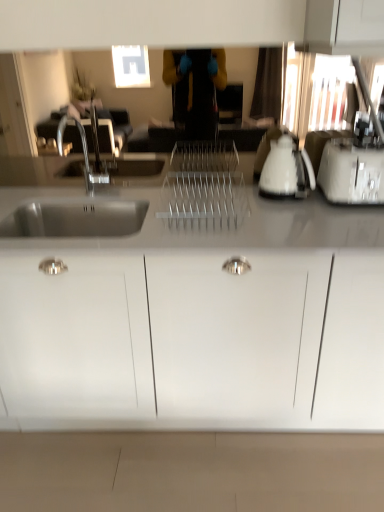
Find the location of a particular element. Image resolution: width=384 pixels, height=512 pixels. free space in front of white glossy electric kettle at right is located at coordinates (296, 214).